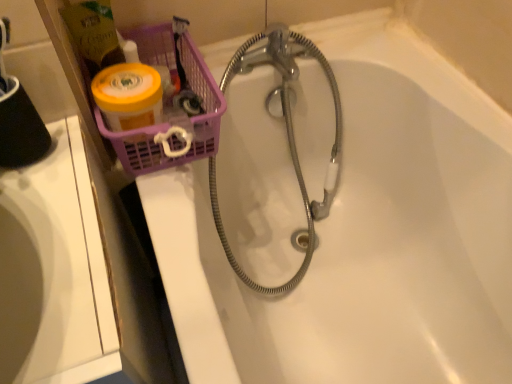
The height and width of the screenshot is (384, 512). What do you see at coordinates (53, 270) in the screenshot? I see `white glossy sink at left` at bounding box center [53, 270].

In order to click on white glossy sink at left in this screenshot , I will do `click(53, 270)`.

Identify the location of translucent plastic basket at upper left. (169, 125).

From the image's perspective, is white glossy sink at left above translucent plastic basket at upper left?

No, from the image's perspective, white glossy sink at left is not above translucent plastic basket at upper left.

From a real-world perspective, between white glossy sink at left and translucent plastic basket at upper left, who is vertically lower?

white glossy sink at left is physically lower.

I want to click on basket above the white glossy sink at left (from a real-world perspective), so click(x=169, y=125).

Can you confirm if translucent plastic basket at upper left is taller than white glossy bathtub at upper center?

Incorrect, the height of translucent plastic basket at upper left is not larger of that of white glossy bathtub at upper center.

Would you say translucent plastic basket at upper left is to the left or to the right of white glossy bathtub at upper center in the picture?

translucent plastic basket at upper left is to the left of white glossy bathtub at upper center.

Does translucent plastic basket at upper left come behind white glossy bathtub at upper center?

Yes, translucent plastic basket at upper left is behind white glossy bathtub at upper center.

From a real-world perspective, who is located lower, translucent plastic basket at upper left or white glossy bathtub at upper center?

white glossy bathtub at upper center.

Which object is positioned more to the left, translucent plastic basket at upper left or white glossy sink at left?

From the viewer's perspective, white glossy sink at left appears more on the left side.

Looking at this image, which is correct: translucent plastic basket at upper left is inside white glossy sink at left, or outside of it?

translucent plastic basket at upper left is spatially situated outside white glossy sink at left.

Which object is wider, translucent plastic basket at upper left or white glossy sink at left?

With larger width is white glossy sink at left.

Does point (175, 65) appear closer or farther from the camera than point (18, 343)?

Point (175, 65) appears to be farther away from the viewer than point (18, 343).

Between point (409, 169) and point (154, 41), which one is positioned behind?

The point (409, 169) is farther from the camera.

Is white glossy bathtub at upper center behind translucent plastic basket at upper left?

No, it is in front of translucent plastic basket at upper left.

Who is shorter, white glossy bathtub at upper center or translucent plastic basket at upper left?

translucent plastic basket at upper left is shorter.

Based on the photo, could translucent plastic basket at upper left be considered to be inside white glossy bathtub at upper center?

No, translucent plastic basket at upper left is not a part of white glossy bathtub at upper center.

In the scene shown: Is white glossy bathtub at upper center far from white glossy sink at left?

That's not correct — white glossy bathtub at upper center is a little close to white glossy sink at left.

Does white glossy bathtub at upper center have a smaller size compared to white glossy sink at left?

Yes, white glossy bathtub at upper center is smaller than white glossy sink at left.

From a real-world perspective, does white glossy bathtub at upper center stand above white glossy sink at left?

Yes.

From the image's perspective, between white glossy bathtub at upper center and white glossy sink at left, who is located below?

white glossy sink at left is shown below in the image.

Looking at this image, does white glossy sink at left have a lesser width compared to white glossy bathtub at upper center?

Correct, the width of white glossy sink at left is less than that of white glossy bathtub at upper center.

Consider the image. Is white glossy bathtub at upper center inside white glossy sink at left?

No.

Is white glossy sink at left aimed at white glossy bathtub at upper center?

No, white glossy sink at left is not oriented towards white glossy bathtub at upper center.

Based on their positions, is white glossy sink at left located to the left or right of white glossy bathtub at upper center?

In the image, white glossy sink at left appears on the left side of white glossy bathtub at upper center.

Find the location of `basket located above the white glossy sink at left (from the image's perspective)`. basket located above the white glossy sink at left (from the image's perspective) is located at coordinates tap(169, 125).

What are the coordinates of `basket above the white glossy bathtub at upper center (from a real-world perspective)` in the screenshot? It's located at (169, 125).

Based on their spatial positions, is white glossy bathtub at upper center or white glossy sink at left closer to translucent plastic basket at upper left?

white glossy sink at left.

Estimate the real-world distances between objects in this image. Which object is closer to translucent plastic basket at upper left, white glossy sink at left or white glossy bathtub at upper center?

Among the two, white glossy sink at left is located nearer to translucent plastic basket at upper left.

Based on their spatial positions, is white glossy sink at left or translucent plastic basket at upper left further from white glossy bathtub at upper center?

Among the two, white glossy sink at left is located further to white glossy bathtub at upper center.

When comparing their distances from white glossy bathtub at upper center, does translucent plastic basket at upper left or white glossy sink at left seem closer?

translucent plastic basket at upper left is positioned closer to the anchor white glossy bathtub at upper center.

When comparing their distances from white glossy sink at left, does white glossy bathtub at upper center or translucent plastic basket at upper left seem further?

Based on the image, white glossy bathtub at upper center appears to be further to white glossy sink at left.

When comparing their distances from white glossy sink at left, does translucent plastic basket at upper left or white glossy bathtub at upper center seem closer?

Among the two, translucent plastic basket at upper left is located nearer to white glossy sink at left.

This screenshot has height=384, width=512. Find the location of `basket located between white glossy sink at left and white glossy bathtub at upper center in the left-right direction`. basket located between white glossy sink at left and white glossy bathtub at upper center in the left-right direction is located at coordinates (169, 125).